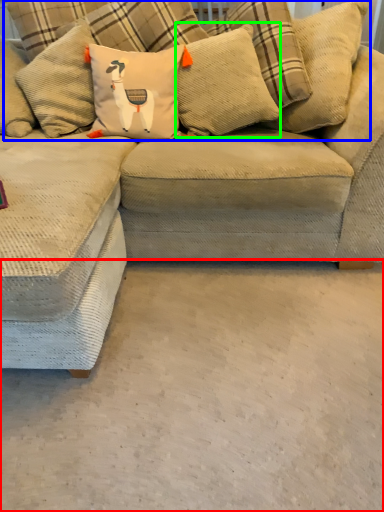
Question: Which object is the closest to the concrete (highlighted by a red box)? Choose among these: pillow (highlighted by a blue box) or pillow (highlighted by a green box).

Choices:
 (A) pillow
 (B) pillow

Answer: (B)